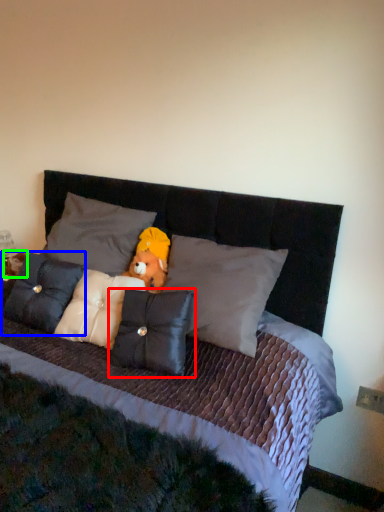
Question: Which object is positioned farthest from pillow (highlighted by a red box)? Select from pillow (highlighted by a blue box) and figurine (highlighted by a green box).

Choices:
 (A) pillow
 (B) figurine

Answer: (B)